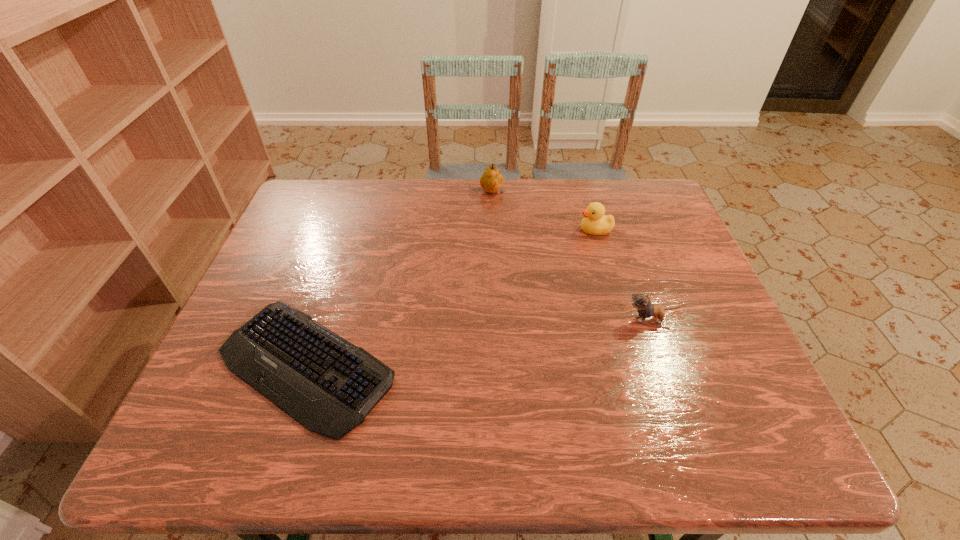
The height and width of the screenshot is (540, 960). In order to click on unoccupied area between the kitten and the shortest object in this screenshot , I will do `click(478, 342)`.

Where is `free point between the kitten and the shortest object`? free point between the kitten and the shortest object is located at coordinates (478, 342).

At what (x,y) coordinates should I click in order to perform the action: click on free space between the second farthest object and the shortest object. Please return your answer as a coordinate pair (x, y). The height and width of the screenshot is (540, 960). Looking at the image, I should click on (450, 298).

This screenshot has height=540, width=960. Identify the location of vacant area between the pear and the duck. (543, 212).

Where is `empty location between the kitten and the duck`? empty location between the kitten and the duck is located at coordinates (622, 275).

Locate an element on the screen. blank region between the leftmost object and the kitten is located at coordinates (478, 342).

Locate an element on the screen. The width and height of the screenshot is (960, 540). object that stands as the closest to the second object from left to right is located at coordinates (594, 222).

Locate an element on the screen. This screenshot has width=960, height=540. the second closest object to the kitten is located at coordinates (329, 385).